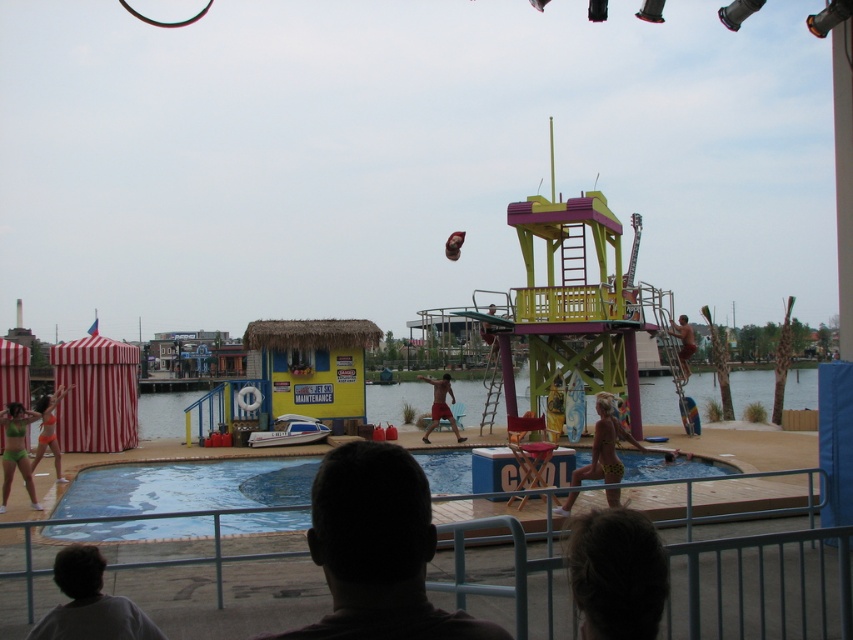
Question: Observing the image, what is the correct spatial positioning of yellow-green swimsuit at center in reference to reddish-brown skin at center?

Choices:
 (A) above
 (B) below

Answer: (A)

Question: Considering the relative positions of green fabric bikini at lower left and smooth tan skin at right in the image provided, where is green fabric bikini at lower left located with respect to smooth tan skin at right?

Choices:
 (A) left
 (B) right

Answer: (A)

Question: Which object appears farthest from the camera in this image?

Choices:
 (A) green fabric bikini at lower left
 (B) white matte shirt at lower left
 (C) yellow fabric person at center

Answer: (C)

Question: Can you confirm if blonde hair at lower center is positioned to the left of green fabric bikini at lower left?

Choices:
 (A) no
 (B) yes

Answer: (A)

Question: Which point is closer to the camera?

Choices:
 (A) (316, 557)
 (B) (577, 492)
 (C) (456, 432)
 (D) (677, 353)

Answer: (A)

Question: Which of the following is the farthest from the observer?

Choices:
 (A) green fabric bikini at lower left
 (B) smooth tan skin at right
 (C) yellow-green swimsuit at center

Answer: (B)